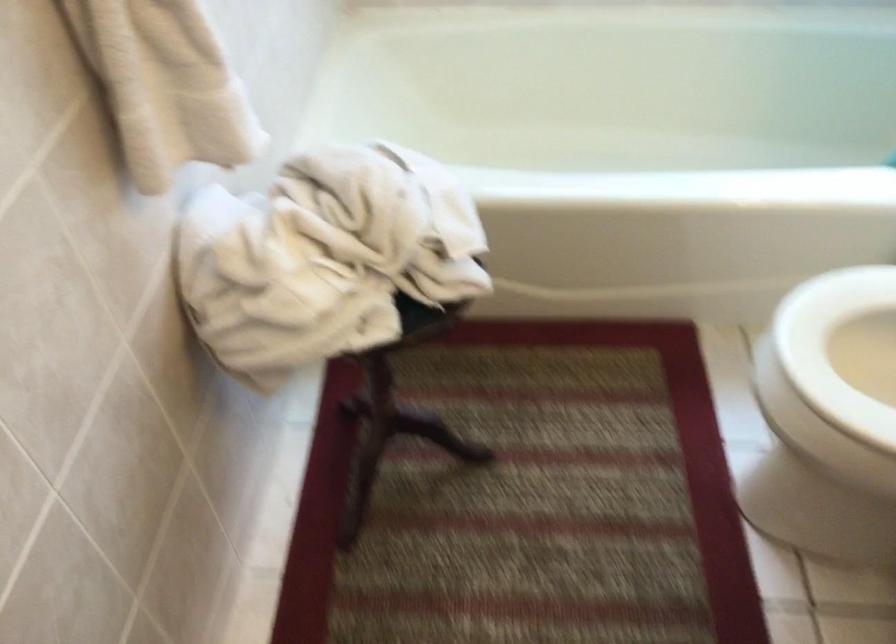
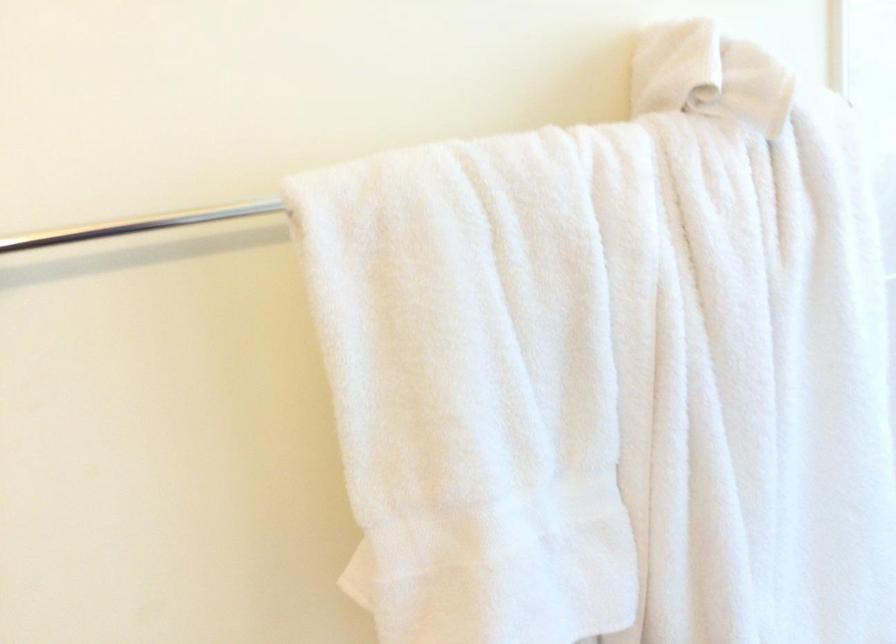
Question: The camera is either moving clockwise (left) or counter-clockwise (right) around the object. The first image is from the beginning of the video and the second image is from the end. Is the camera moving left or right when shooting the video?

Choices:
 (A) Left
 (B) Right

Answer: (B)